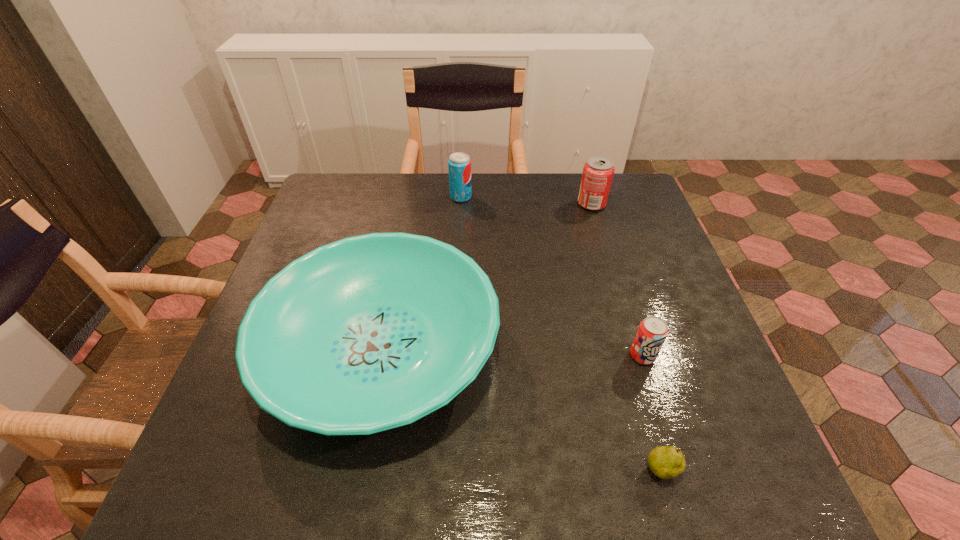
Find the location of a particular element. vacant space in between the leftmost soda can and the pear is located at coordinates (562, 334).

The width and height of the screenshot is (960, 540). Find the location of `empty location between the dish and the nearest soda can`. empty location between the dish and the nearest soda can is located at coordinates (512, 352).

Identify the location of free spot between the dish and the shortest object. (521, 409).

I want to click on free space that is in between the leftmost soda can and the pear, so click(x=562, y=334).

Point out which object is positioned as the nearest to the leftmost soda can. Please provide its 2D coordinates. Your answer should be formatted as a tuple, i.e. [(x, y)], where the tuple contains the x and y coordinates of a point satisfying the conditions above.

[(368, 333)]

What are the coordinates of `object that stands as the fourth closest to the dish` in the screenshot? It's located at (598, 171).

Locate which soda can is the second closest to the nearest soda can. Please provide its 2D coordinates. Your answer should be formatted as a tuple, i.e. [(x, y)], where the tuple contains the x and y coordinates of a point satisfying the conditions above.

[(459, 164)]

At what (x,y) coordinates should I click in order to perform the action: click on the third closest soda can to the dish. Please return your answer as a coordinate pair (x, y). This screenshot has height=540, width=960. Looking at the image, I should click on (598, 171).